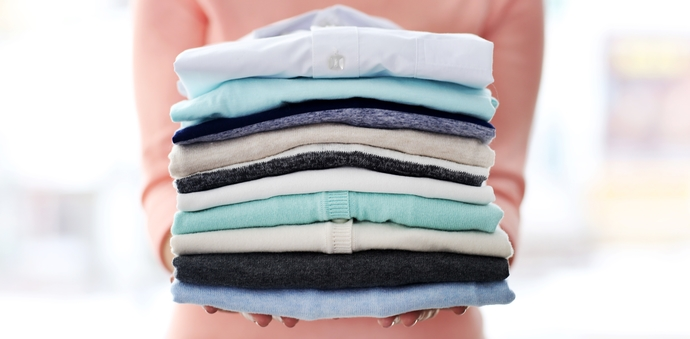
Find the location of a particular element. The height and width of the screenshot is (339, 690). folded shirt is located at coordinates (342, 309), (339, 274), (339, 237), (337, 208), (334, 174), (337, 158), (335, 134), (348, 112), (357, 90), (348, 57).